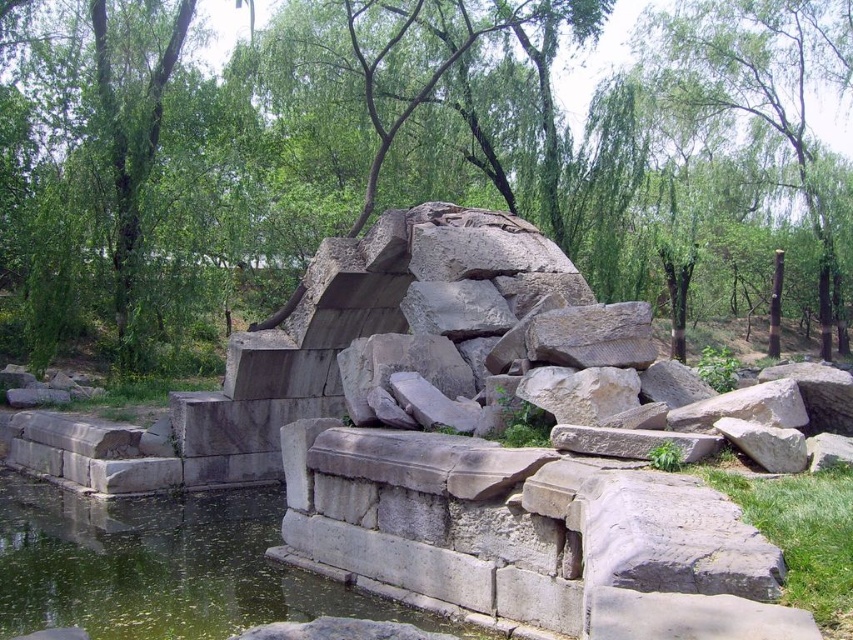
Can you confirm if green leafy tree at center is thinner than green leafy tree at upper center?

Incorrect, green leafy tree at center's width is not less than green leafy tree at upper center's.

Can you confirm if green leafy tree at center is wider than green leafy tree at upper center?

Indeed, green leafy tree at center has a greater width compared to green leafy tree at upper center.

Measure the distance between point (677, 44) and camera.

Point (677, 44) is 150.94 meters away from camera.

Image resolution: width=853 pixels, height=640 pixels. Identify the location of green leafy tree at center. (404, 154).

Does greenish murky water at lower left have a smaller size compared to green leafy tree at upper center?

Correct, greenish murky water at lower left occupies less space than green leafy tree at upper center.

You are a GUI agent. You are given a task and a screenshot of the screen. Output one action in this format:
    pyautogui.click(x=<x>, y=<y>)
    Task: Click on the greenish murky water at lower left
    
    Given the screenshot: What is the action you would take?
    pyautogui.click(x=161, y=566)

Does point (399, 56) lie behind point (119, 522)?

Yes, it is behind point (119, 522).

Does green leafy tree at center have a smaller size compared to greenish murky water at lower left?

Actually, green leafy tree at center might be larger than greenish murky water at lower left.

Locate an element on the screen. green leafy tree at center is located at coordinates (404, 154).

Locate an element on the screen. Image resolution: width=853 pixels, height=640 pixels. green leafy tree at center is located at coordinates (x=404, y=154).